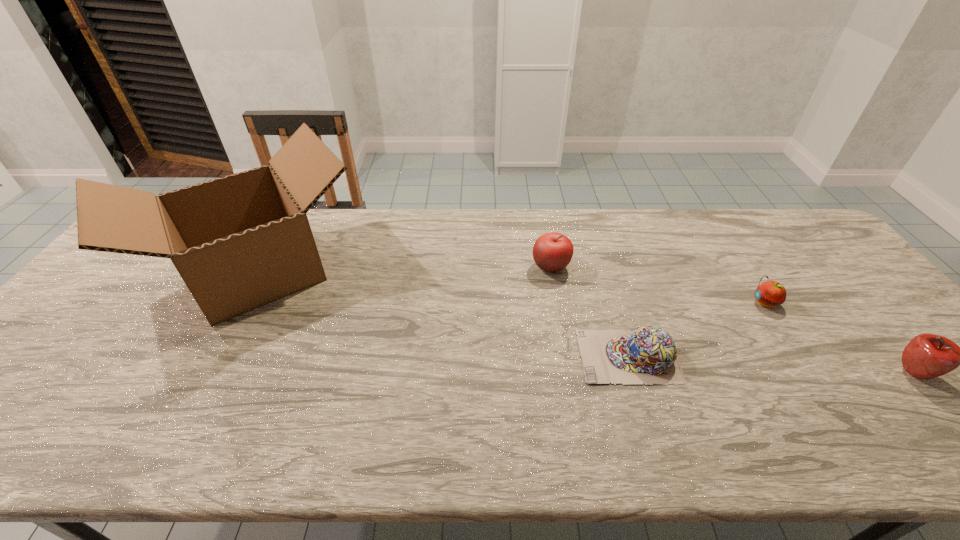
What are the coordinates of `vacant region that satisfies the following two spatial constraints: 1. on the back side of the nearest apple; 2. on the front, side, and top of the cap` in the screenshot? It's located at (900, 356).